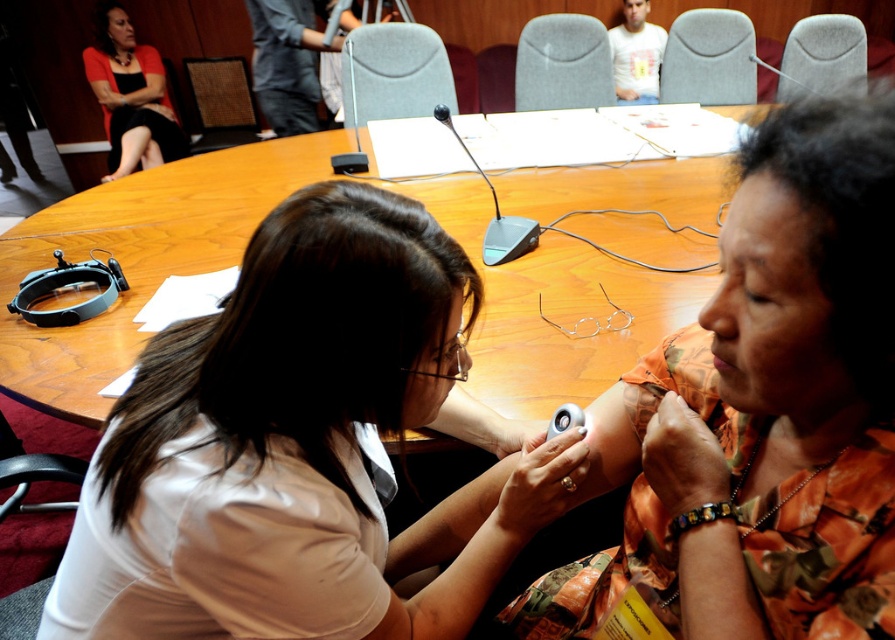
Does point (716, 513) lie behind point (697, 193)?

That is False.

Describe the element at coordinates (766, 408) in the screenshot. Image resolution: width=895 pixels, height=640 pixels. I see `orange floral shirt at center` at that location.

You are a GUI agent. You are given a task and a screenshot of the screen. Output one action in this format:
    pyautogui.click(x=<x>, y=<y>)
    Task: Click on the orange floral shirt at center
    
    Given the screenshot: What is the action you would take?
    pyautogui.click(x=766, y=408)

Does point (350, 534) come behind point (704, 164)?

No, (350, 534) is closer to viewer.

Does white matte shirt at center have a lesser width compared to wooden at center?

Yes.

Who is more distant from viewer, (151,440) or (22,268)?

Point (22,268)

The width and height of the screenshot is (895, 640). Find the location of `white matte shirt at center`. white matte shirt at center is located at coordinates (297, 444).

Does white matte shirt at center have a greater height compared to orange floral shirt at center?

No.

Measure the distance between point (186, 602) and camera.

25.94 inches

Which is behind, point (310, 456) or point (703, 580)?

Positioned behind is point (310, 456).

Locate an element on the screen. Image resolution: width=895 pixels, height=640 pixels. white matte shirt at center is located at coordinates (297, 444).